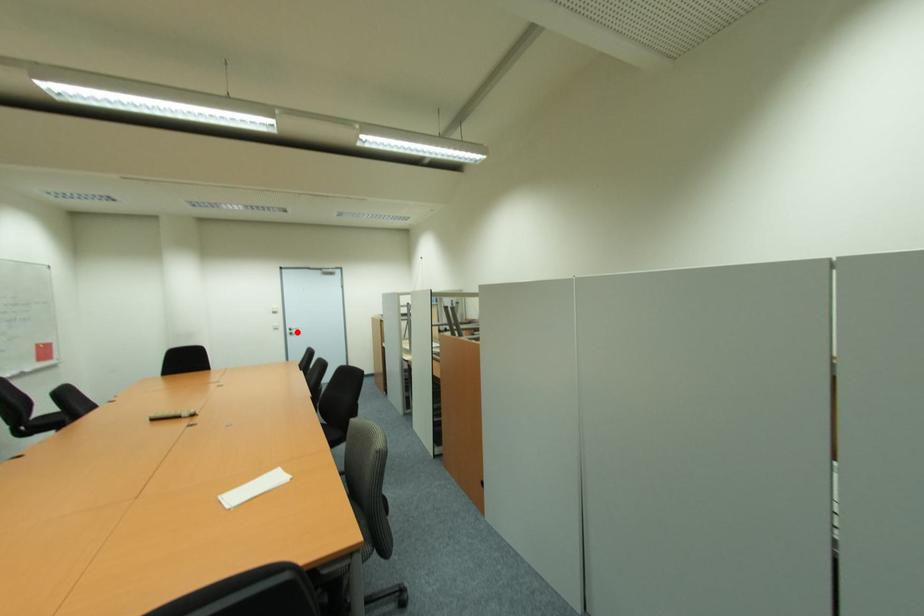
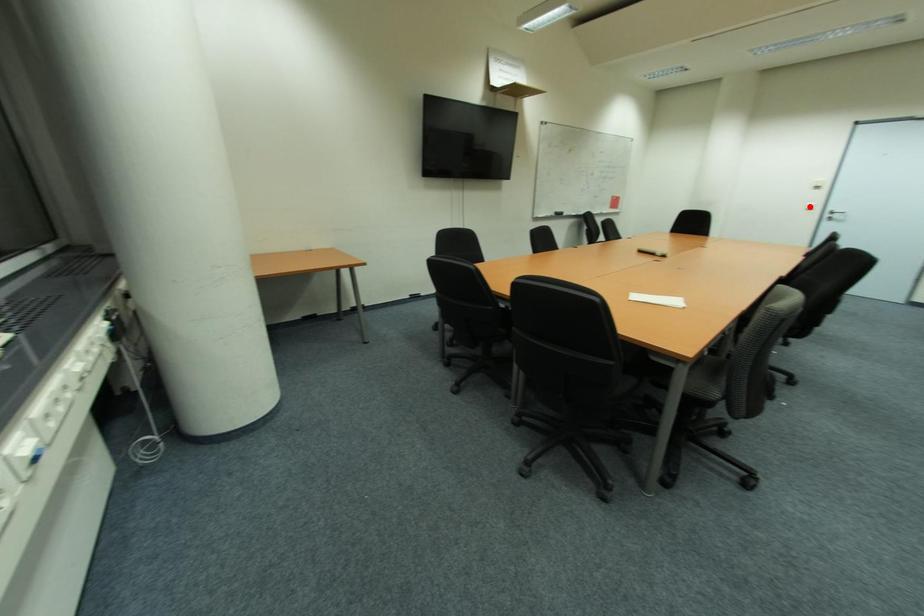
I am providing you with two images of the same scene from different viewpoints. A red point is marked on the first image and another point is marked on the second image. Is the red point in image1 aligned with the point shown in image2?

No